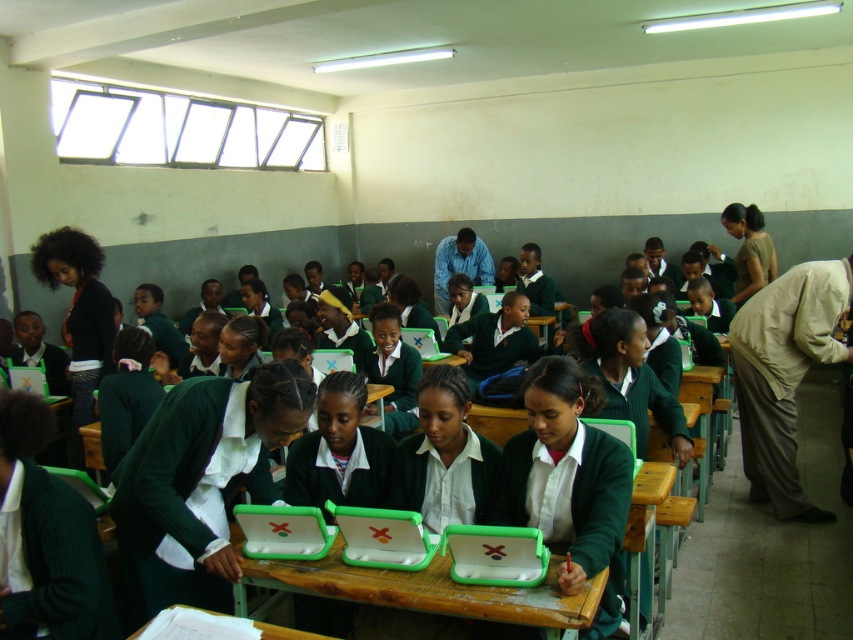
Consider the image. Can you confirm if wooden desk at center is positioned below green matte laptop at center?

Yes.

Is point (291, 609) positioned behind point (421, 348)?

No.

Identify the location of wooden desk at center. The width and height of the screenshot is (853, 640). (286, 632).

Is point (555, 570) farther from viewer compared to point (279, 632)?

Yes, it is.

How distant is green plastic laptops at center from wooden desk at center?

green plastic laptops at center is 12.32 inches away from wooden desk at center.

At what (x,y) coordinates should I click in order to perform the action: click on green plastic laptops at center. Please return your answer as a coordinate pair (x, y). This screenshot has height=640, width=853. Looking at the image, I should click on (422, 589).

Identify the location of green plastic laptops at center. This screenshot has width=853, height=640. (422, 589).

In the scene shown: Who is taller, green plastic laptops at center or green matte laptop at center?

Result: green plastic laptops at center

Measure the distance from green plastic laptops at center to green matte laptop at center.

The distance of green plastic laptops at center from green matte laptop at center is 8.82 feet.

Between point (583, 593) and point (430, 339), which one is positioned in front?

Point (583, 593) is in front.

Where is `green plastic laptops at center`? This screenshot has width=853, height=640. green plastic laptops at center is located at coordinates (422, 589).